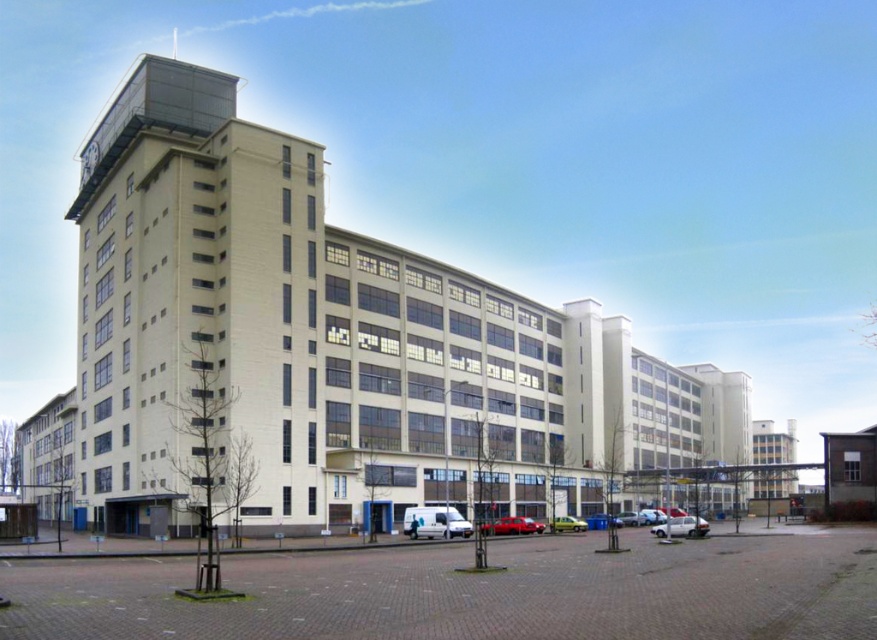
Who is higher up, silver metallic car at lower center or shiny red car at center?

Positioned higher is silver metallic car at lower center.

Can you confirm if silver metallic car at lower center is wider than shiny red car at center?

Yes, silver metallic car at lower center is wider than shiny red car at center.

Does point (702, 524) come closer to viewer compared to point (528, 524)?

Yes, it is in front of point (528, 524).

What are the coordinates of `silver metallic car at lower center` in the screenshot? It's located at (681, 525).

Measure the distance between point [507,531] and camera.

Point [507,531] is 80.62 meters away from camera.

Which of these two, shiny red car at center or yellow matte van at center, stands taller?

With more height is yellow matte van at center.

Between point (511, 522) and point (585, 524), which one is positioned behind?

The point (585, 524) is behind.

Where is `shiny red car at center`? Image resolution: width=877 pixels, height=640 pixels. shiny red car at center is located at coordinates click(511, 525).

Is point (690, 520) more distant than point (571, 524)?

That is False.

Is silver metallic car at lower center to the right of yellow matte van at center from the viewer's perspective?

Indeed, silver metallic car at lower center is positioned on the right side of yellow matte van at center.

Between point (662, 534) and point (550, 524), which one is positioned in front?

Positioned in front is point (662, 534).

Locate an element on the screen. The width and height of the screenshot is (877, 640). silver metallic car at lower center is located at coordinates (681, 525).